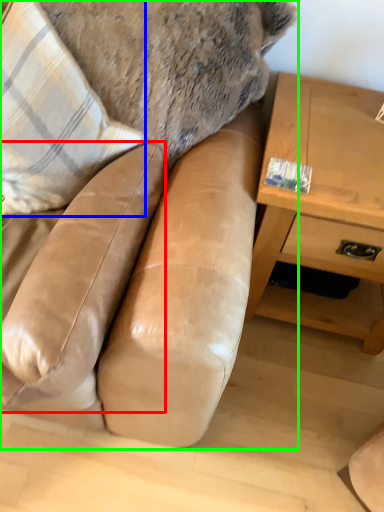
Question: Which is nearer to the swivel chair (highlighted by a red box)? throw pillow (highlighted by a blue box) or studio couch (highlighted by a green box).

Choices:
 (A) throw pillow
 (B) studio couch

Answer: (B)